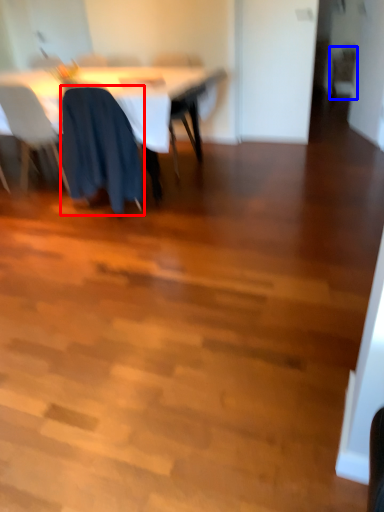
Question: Which object is further to the camera taking this photo, chair (highlighted by a red box) or chair (highlighted by a blue box)?

Choices:
 (A) chair
 (B) chair

Answer: (B)